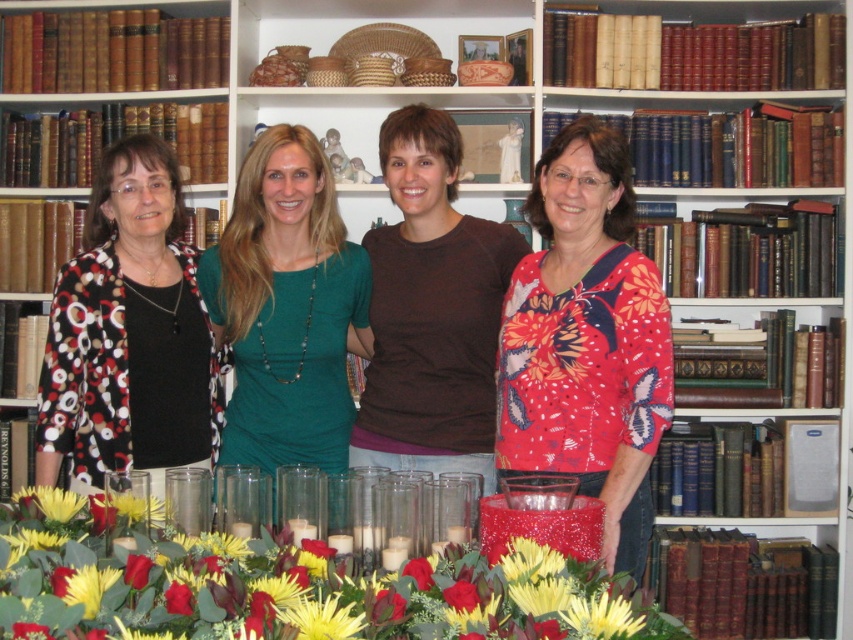
You are standing in front of the bookshelf and want to reach a point at coordinates point (x=625, y=148). If your arm can extend 1.8 meters, can you reach that point?

The distance of point (x=625, y=148) from camera is 2.15 meters, so your arm cannot reach it since it is further away than your arm can extend.

You are a photographer trying to capture a detail shot of the floral print blouse at center and the printed fabric blouse at left. Which blouse is positioned lower in the frame?

The floral print blouse at center is positioned lower in the frame than the printed fabric blouse at left.